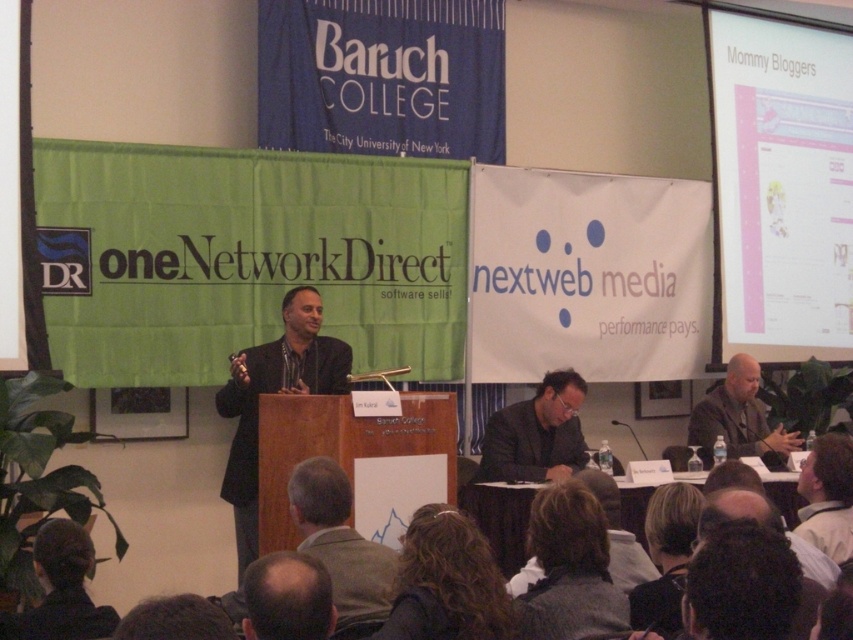
You are sitting in the audience and want to wave to both the dark gray suit at center and the dark brown hair at lower left. Which one would you need to lean forward more to reach?

You would need to lean forward more to wave to the dark brown hair at lower left because it is farther away from you than the dark gray suit at center.

Based on the scene description, which object is larger in size between the dark gray suit at center and the dark brown hair at lower left?

The dark gray suit at center is larger in size than the dark brown hair at lower left.